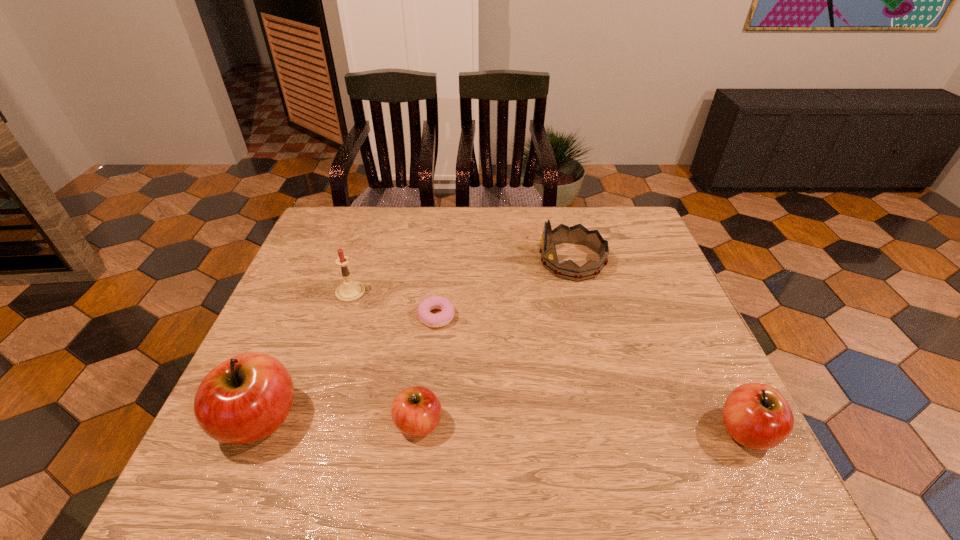
Locate an element on the screen. Image resolution: width=960 pixels, height=540 pixels. object located at the right edge is located at coordinates (757, 416).

Identify the location of object at the near left corner. [246, 398].

The image size is (960, 540). Identify the location of object that is at the near right corner. (757, 416).

The image size is (960, 540). I want to click on vacant space at the far edge, so click(420, 215).

At what (x,y) coordinates should I click in order to perform the action: click on free space at the near edge of the desktop. Please return your answer as a coordinate pair (x, y). This screenshot has width=960, height=540. Looking at the image, I should click on (300, 434).

Where is `vacant space at the right edge of the desktop`? vacant space at the right edge of the desktop is located at coordinates (708, 394).

In the image, there is a desktop. Where is `free space at the far left corner`? The height and width of the screenshot is (540, 960). free space at the far left corner is located at coordinates (341, 221).

This screenshot has height=540, width=960. I want to click on free space at the far right corner, so click(x=633, y=233).

Locate an element on the screen. free space at the near right corner of the desktop is located at coordinates (702, 412).

Where is `free space between the shortest apple and the rightmost apple`? The height and width of the screenshot is (540, 960). free space between the shortest apple and the rightmost apple is located at coordinates pos(582,427).